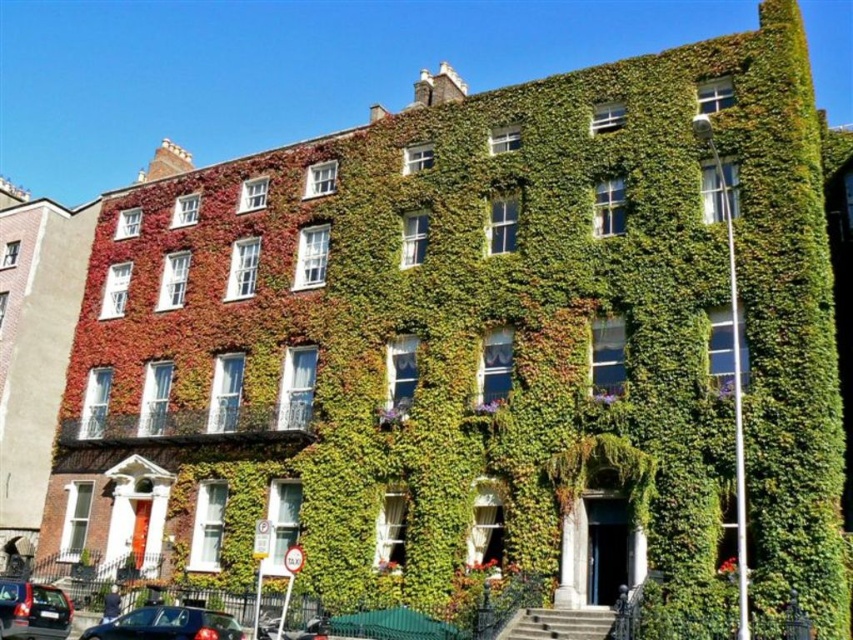
Does shiny black car at lower left have a lesser height compared to metallic gray sedan at lower left?

No, shiny black car at lower left is not shorter than metallic gray sedan at lower left.

Between shiny black car at lower left and metallic gray sedan at lower left, which one is positioned lower?

Positioned lower is metallic gray sedan at lower left.

Measure the distance between shiny black car at lower left and camera.

The distance of shiny black car at lower left from camera is 35.56 meters.

Find the location of a particular element. This screenshot has height=640, width=853. shiny black car at lower left is located at coordinates (167, 625).